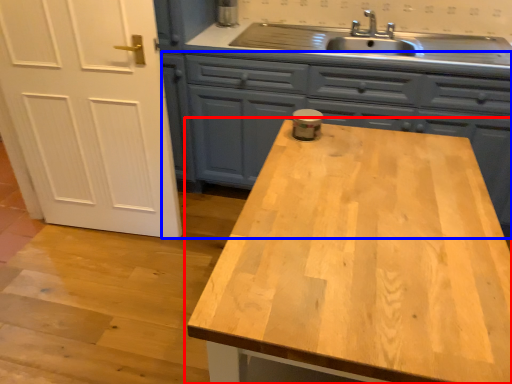
Question: Which object appears closest to the camera in this image, countertop (highlighted by a red box) or cabinetry (highlighted by a blue box)?

Choices:
 (A) countertop
 (B) cabinetry

Answer: (A)